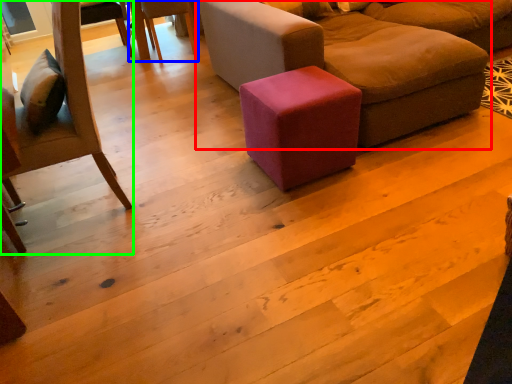
Question: Based on their relative distances, which object is nearer to studio couch (highlighted by a red box)? Choose from chair (highlighted by a blue box) and chair (highlighted by a green box).

Choices:
 (A) chair
 (B) chair

Answer: (B)